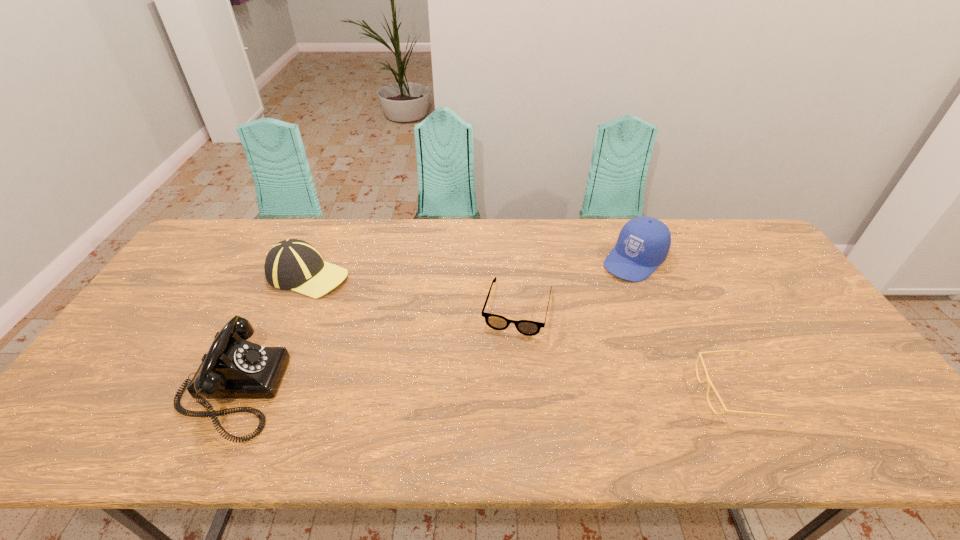
The image size is (960, 540). I want to click on free space on the desktop that is between the telephone and the nearer spectacles and is positioned on the front-facing side of the cap, so click(493, 391).

You are a GUI agent. You are given a task and a screenshot of the screen. Output one action in this format:
    pyautogui.click(x=<x>, y=<y>)
    Task: Click on the free spot on the desktop that is between the telephone and the nearer spectacles and is positioned with the brim of the third tallest object facing forward
    
    Given the screenshot: What is the action you would take?
    pyautogui.click(x=490, y=391)

The width and height of the screenshot is (960, 540). In order to click on vacant space on the desktop that is between the telephone and the nearer spectacles and is positioned on the arms of the farther spectacles in this screenshot , I will do `click(497, 391)`.